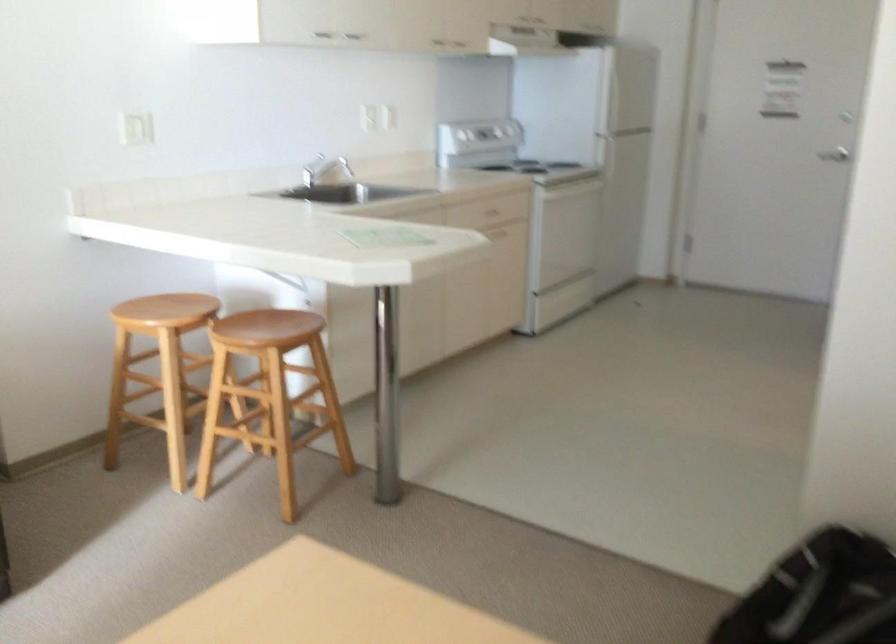
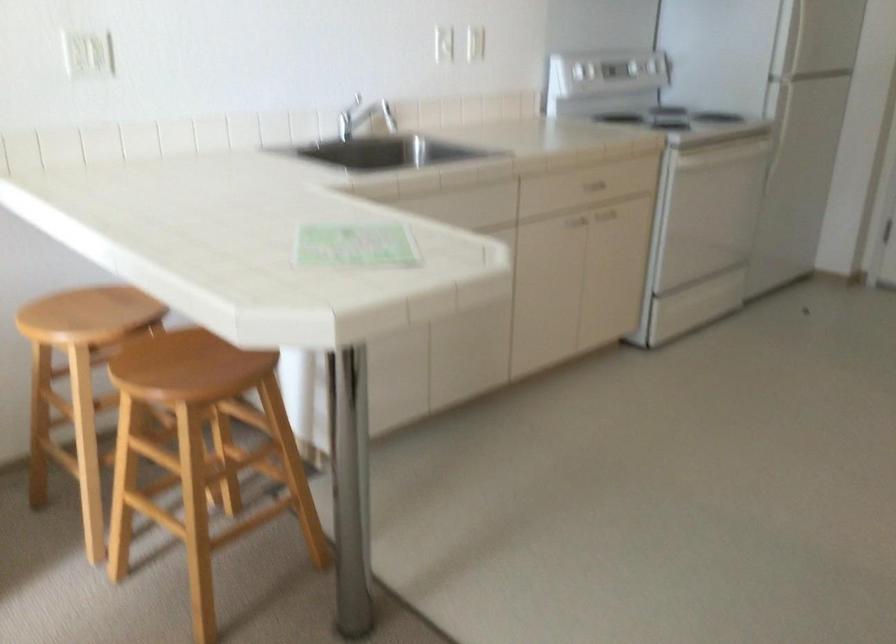
In the second image, find the point that corresponds to (572,216) in the first image.

(714, 202)